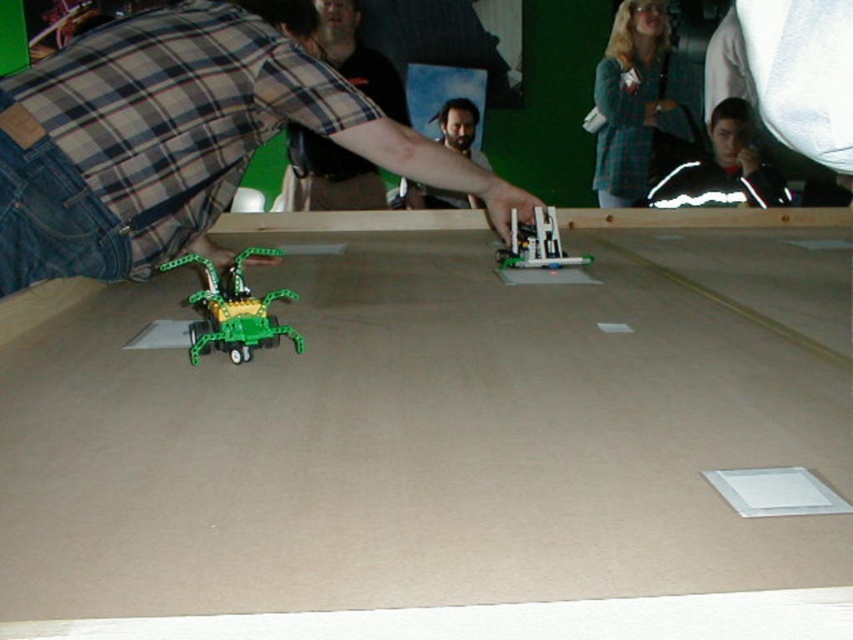
Question: Which of the following is the closest to the observer?

Choices:
 (A) (653, 138)
 (B) (543, 236)

Answer: (B)

Question: Can you confirm if green plaid shirt at upper center is wider than black fleece jacket at upper right?

Choices:
 (A) yes
 (B) no

Answer: (B)

Question: Is brown cardboard table at center positioned at the back of green plaid shirt at upper center?

Choices:
 (A) yes
 (B) no

Answer: (B)

Question: Which object appears farthest from the camera in this image?

Choices:
 (A) plaid fabric shirt at center
 (B) translucent plastic robot at center
 (C) brown cardboard table at center

Answer: (A)

Question: Is brown cardboard table at center to the right of plaid fabric shirt at center from the viewer's perspective?

Choices:
 (A) no
 (B) yes

Answer: (B)

Question: Which point is farther to the camera?

Choices:
 (A) green plaid shirt at upper center
 (B) brown cardboard table at center
 (C) black fleece jacket at upper right

Answer: (A)